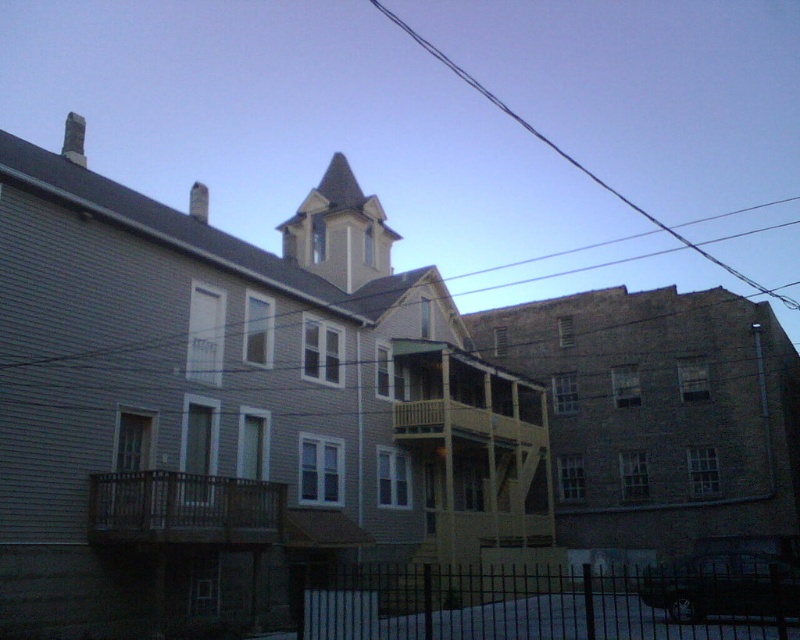
You are standing in the residential area and see both the gray siding church at center and the brown brick church at center. Which one is closer to you?

The gray siding church at center is closer to you because it is in front of the brown brick church at center.